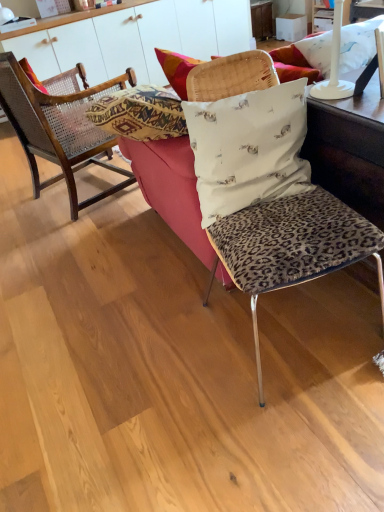
Question: Is wooden cane chair at left, the second chair when ordered from front to back, in front of leopard print cushion at center, the second chair from the left?

Choices:
 (A) no
 (B) yes

Answer: (A)

Question: Is wooden cane chair at left, positioned as the second chair in right-to-left order, positioned behind leopard print cushion at center, the second chair from the left?

Choices:
 (A) no
 (B) yes

Answer: (B)

Question: Can we say wooden cane chair at left, the second chair when ordered from front to back, lies outside leopard print cushion at center, acting as the 2th chair starting from the back?

Choices:
 (A) yes
 (B) no

Answer: (A)

Question: From the image's perspective, does wooden cane chair at left, positioned as the second chair in right-to-left order, appear higher than leopard print cushion at center, the 1th chair positioned from the front?

Choices:
 (A) no
 (B) yes

Answer: (B)

Question: Considering the relative sizes of wooden cane chair at left, the second chair when ordered from front to back, and leopard print cushion at center, the 1th chair viewed from the right, in the image provided, is wooden cane chair at left, the second chair when ordered from front to back, smaller than leopard print cushion at center, the 1th chair viewed from the right,?

Choices:
 (A) yes
 (B) no

Answer: (B)

Question: Can you confirm if wooden cane chair at left, positioned as the second chair in right-to-left order, is thinner than leopard print cushion at center, the second chair from the left?

Choices:
 (A) yes
 (B) no

Answer: (B)

Question: Is leopard print fabric couch at center thinner than wooden cane chair at left, positioned as the second chair in right-to-left order?

Choices:
 (A) yes
 (B) no

Answer: (B)

Question: Does leopard print fabric couch at center come behind wooden cane chair at left, the first chair viewed from the back?

Choices:
 (A) no
 (B) yes

Answer: (A)

Question: Considering the relative sizes of leopard print fabric couch at center and wooden cane chair at left, positioned as the second chair in right-to-left order, in the image provided, is leopard print fabric couch at center smaller than wooden cane chair at left, positioned as the second chair in right-to-left order,?

Choices:
 (A) yes
 (B) no

Answer: (B)

Question: From the image's perspective, is leopard print fabric couch at center below wooden cane chair at left, the 1th chair in the left-to-right sequence?

Choices:
 (A) yes
 (B) no

Answer: (A)

Question: Considering the relative sizes of leopard print fabric couch at center and wooden cane chair at left, the 1th chair in the left-to-right sequence, in the image provided, is leopard print fabric couch at center bigger than wooden cane chair at left, the 1th chair in the left-to-right sequence,?

Choices:
 (A) no
 (B) yes

Answer: (B)

Question: Is leopard print fabric couch at center outside wooden cane chair at left, the 1th chair in the left-to-right sequence?

Choices:
 (A) no
 (B) yes

Answer: (B)

Question: Would you say leopard print fabric couch at center is part of white glossy cabinet at upper center's contents?

Choices:
 (A) no
 (B) yes

Answer: (A)